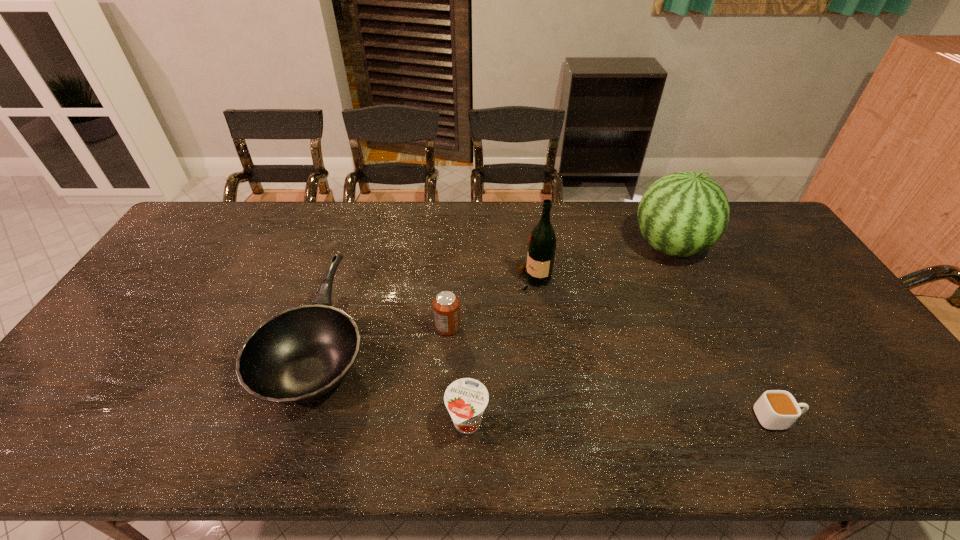
Locate an element on the screen. free space that is in between the yogurt and the shortest object is located at coordinates (622, 421).

The height and width of the screenshot is (540, 960). I want to click on free spot between the can and the yogurt, so click(458, 375).

Locate an element on the screen. free space between the shortest object and the yogurt is located at coordinates (622, 421).

I want to click on free space between the can and the wine bottle, so click(491, 303).

Locate an element on the screen. This screenshot has width=960, height=540. object that stands as the fifth closest to the yogurt is located at coordinates (681, 214).

The image size is (960, 540). I want to click on object that stands as the fifth closest to the cup, so 298,355.

The image size is (960, 540). Identify the location of vacant space that satisfies the following two spatial constraints: 1. on the back side of the frying pan; 2. on the left side of the can. (325, 327).